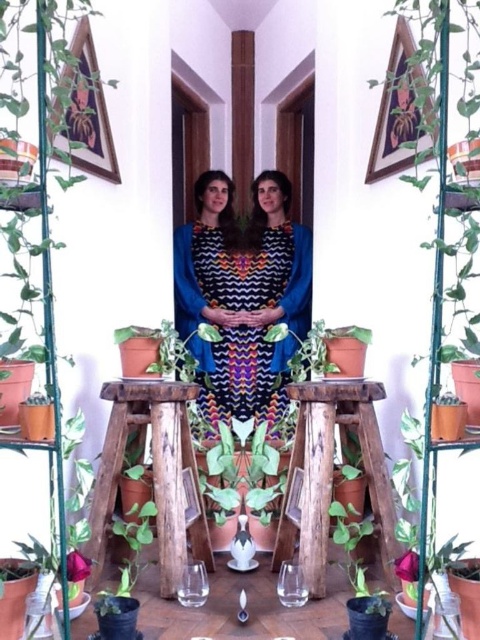
Question: Can you confirm if wooden stool at center is positioned below green matte plant at lower left?

Choices:
 (A) no
 (B) yes

Answer: (A)

Question: Is green leafy plant at left closer to camera compared to green leafy plant at center?

Choices:
 (A) no
 (B) yes

Answer: (A)

Question: Which object is closer to the camera taking this photo?

Choices:
 (A) green leafy plant at center
 (B) green matte plant at lower center
 (C) rustic wood stool at center

Answer: (A)

Question: Can you confirm if green matte plant at lower left is positioned below green matte plant at lower center?

Choices:
 (A) yes
 (B) no

Answer: (B)

Question: Which point is farther to the camera?

Choices:
 (A) rustic wood stool at center
 (B) wooden stool at center
 (C) green leafy plant at left

Answer: (A)

Question: Which point is farther from the camera taking this photo?

Choices:
 (A) (178, 253)
 (B) (428, 68)

Answer: (A)